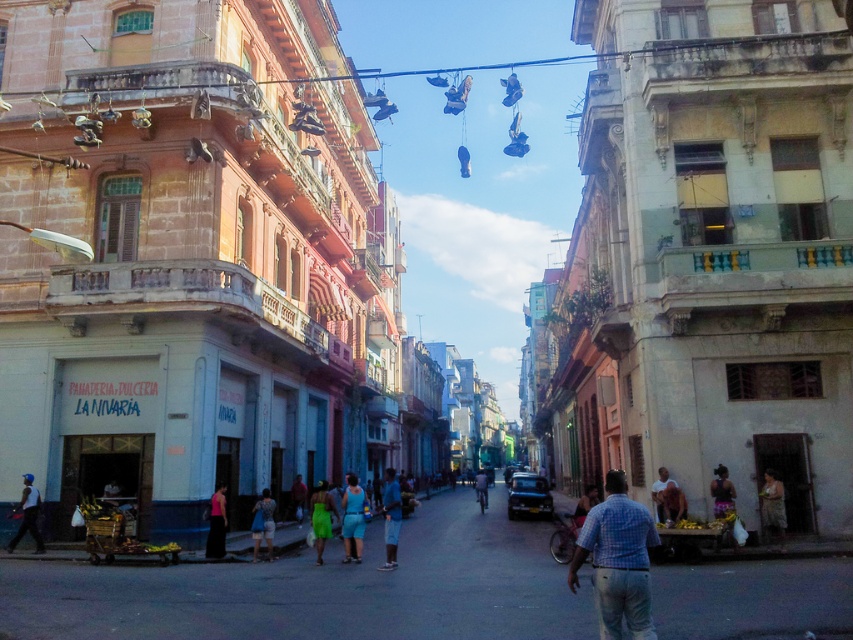
What do you see at coordinates (321, 516) in the screenshot?
I see `green fabric dress at center` at bounding box center [321, 516].

Does point (321, 536) lie behind point (485, 502)?

No, (321, 536) is in front of (485, 502).

Identify the location of green fabric dress at center. (321, 516).

Which is above, blue fabric shorts at center or green fabric dress at center?

green fabric dress at center

Which is behind, point (387, 513) or point (326, 506)?

The point (326, 506) is more distant.

What are the coordinates of `blue fabric shorts at center` in the screenshot? It's located at (390, 516).

Who is positioned more to the right, metallic wire at upper center or brown fabric dress at lower right?

Positioned to the right is brown fabric dress at lower right.

Is point (837, 38) positioned behind point (769, 518)?

Yes, point (837, 38) is behind point (769, 518).

You are a GUI agent. You are given a task and a screenshot of the screen. Output one action in this format:
    pyautogui.click(x=<x>, y=<y>)
    Task: Click on the metallic wire at upper center
    
    Given the screenshot: What is the action you would take?
    pyautogui.click(x=721, y=49)

Identify the location of metallic wire at upper center. (721, 49).